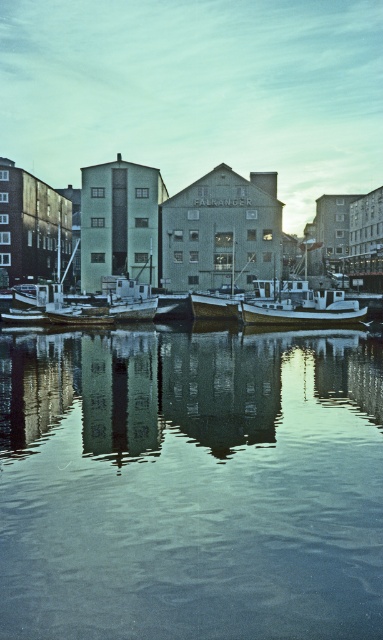
You are standing on the dock and want to take a photo of both the smooth reflective water at center and the white matte boat at center. Which object should you focus on first if you want to capture both in sharp detail?

The smooth reflective water at center is closer to the viewer than the white matte boat at center, so you should focus on the smooth reflective water at center first to ensure both are in focus.

Based on the scene description, where is the smooth reflective water at center located in the image?

The smooth reflective water at center is located at point (191, 484).